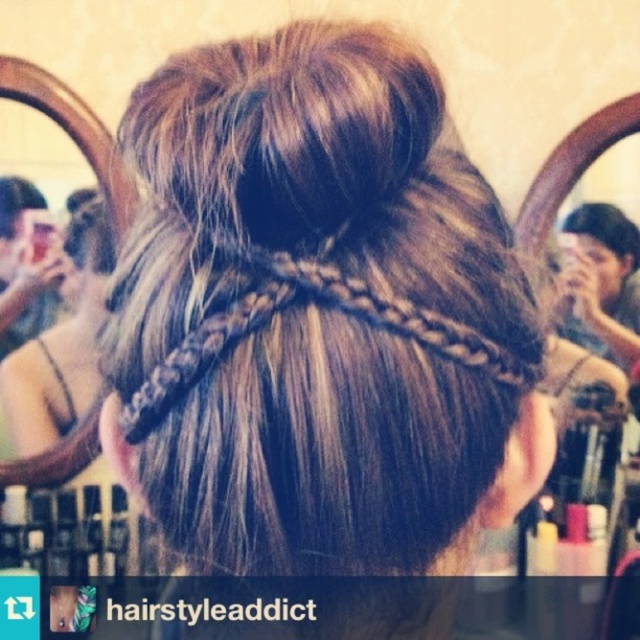
Question: Which of the following is the closest to the observer?

Choices:
 (A) (12, 186)
 (B) (240, 353)
 (C) (570, 228)
 (D) (22, 413)

Answer: (B)

Question: From the image, what is the correct spatial relationship of blonde hair at left in relation to brown matte hair at center?

Choices:
 (A) below
 (B) above

Answer: (A)

Question: Which point is closer to the camera?

Choices:
 (A) dark brown silky hair at center
 (B) brown silky hair at center
 (C) brown matte hair at center
 (D) blonde hair at left

Answer: (A)

Question: Is brown silky hair at center positioned behind brown matte hair at center?

Choices:
 (A) no
 (B) yes

Answer: (B)

Question: Considering the relative positions of blonde hair at left and brown matte hair at center in the image provided, where is blonde hair at left located with respect to brown matte hair at center?

Choices:
 (A) right
 (B) left

Answer: (A)

Question: Among these points, which one is farthest from the camera?

Choices:
 (A) (3, 180)
 (B) (340, 138)

Answer: (A)